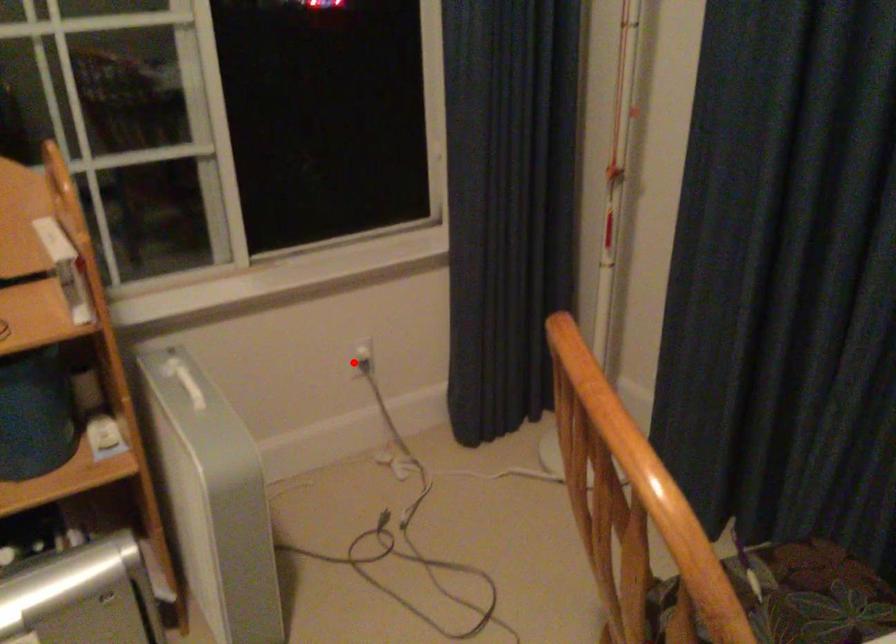
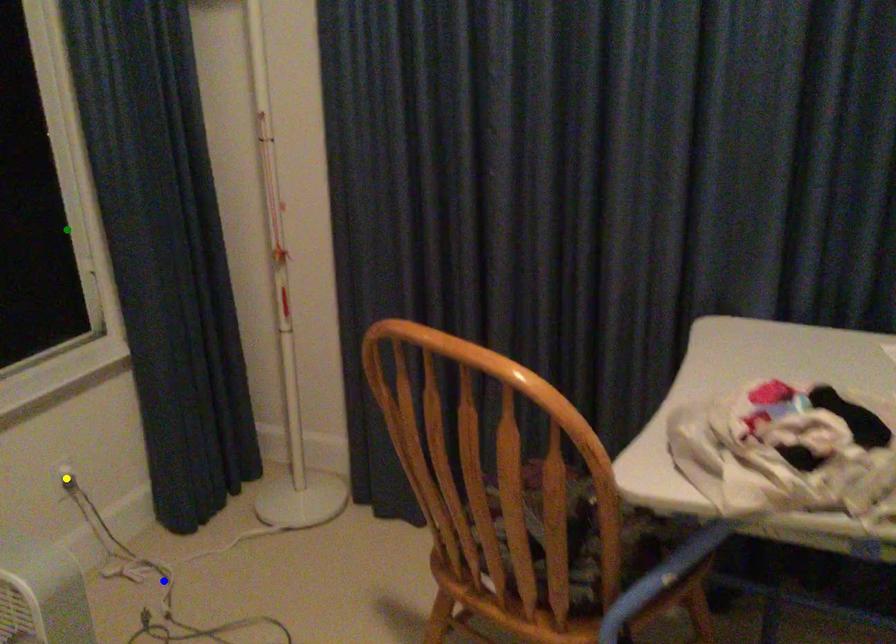
Question: I am providing you with two images of the same scene from different viewpoints. A red point is marked on the first image. You are given multiple points on the second image. In image 2, which mark is for the same physical point as the one in image 1?

Choices:
 (A) blue point
 (B) green point
 (C) yellow point

Answer: (C)